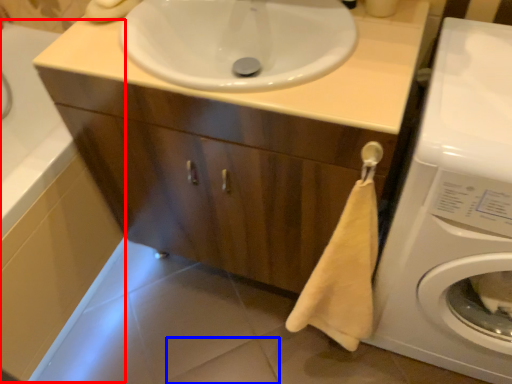
Question: Which object is closer to the camera taking this photo, bath (highlighted by a red box) or tile (highlighted by a blue box)?

Choices:
 (A) bath
 (B) tile

Answer: (A)